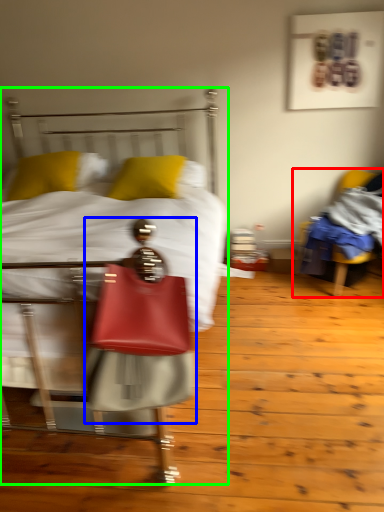
Question: Considering the real-world distances, which object is farthest from chair (highlighted by a red box)? person (highlighted by a blue box) or bed (highlighted by a green box)?

Choices:
 (A) person
 (B) bed

Answer: (A)